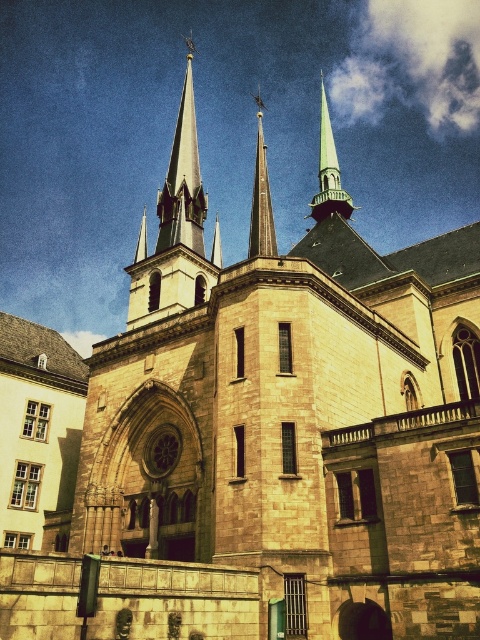
Describe the element at coordinates (182, 179) in the screenshot. I see `smooth gray spire at upper center` at that location.

Which of these two, smooth gray spire at upper center or smooth gray spire at center, stands taller?

smooth gray spire at upper center

Measure the distance between smooth gray spire at upper center and camera.

A distance of 74.18 meters exists between smooth gray spire at upper center and camera.

Find the location of a particular element. smooth gray spire at upper center is located at coordinates (182, 179).

Can you confirm if smooth gray spire at upper center is positioned to the right of shiny silver spire at upper center?

No, smooth gray spire at upper center is not to the right of shiny silver spire at upper center.

Between smooth gray spire at upper center and shiny silver spire at upper center, which one is positioned higher?

smooth gray spire at upper center is higher up.

Between point (192, 196) and point (328, 198), which one is positioned in front?

Point (192, 196)

Where is `smooth gray spire at upper center`? Image resolution: width=480 pixels, height=640 pixels. smooth gray spire at upper center is located at coordinates (182, 179).

Can you confirm if shiny silver spire at upper center is positioned below smooth gray spire at center?

Incorrect, shiny silver spire at upper center is not positioned below smooth gray spire at center.

Can you confirm if shiny silver spire at upper center is positioned above smooth gray spire at center?

Yes.

This screenshot has height=640, width=480. Describe the element at coordinates (328, 172) in the screenshot. I see `shiny silver spire at upper center` at that location.

Identify the location of shiny silver spire at upper center. The height and width of the screenshot is (640, 480). (328, 172).